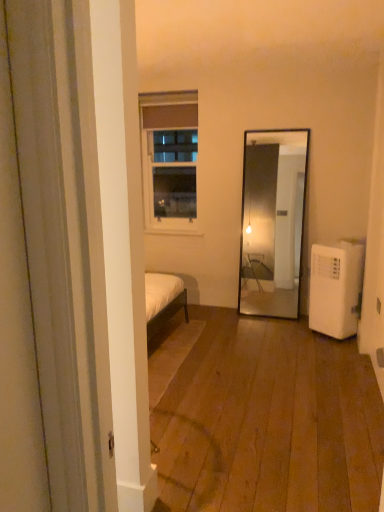
Locate an element on the screen. The height and width of the screenshot is (512, 384). white plastic air conditioner at lower right is located at coordinates (336, 288).

Measure the distance between point (318,273) and camera.

They are 3.74 meters apart.

The height and width of the screenshot is (512, 384). What do you see at coordinates (336, 288) in the screenshot?
I see `white plastic air conditioner at lower right` at bounding box center [336, 288].

What is the approximate height of white plastic air conditioner at lower right?

white plastic air conditioner at lower right is 32.95 inches tall.

This screenshot has width=384, height=512. Identify the location of white glass window at upper center. (169, 157).

The width and height of the screenshot is (384, 512). What do you see at coordinates (169, 157) in the screenshot?
I see `white glass window at upper center` at bounding box center [169, 157].

The image size is (384, 512). In order to click on white plastic air conditioner at lower right in this screenshot , I will do `click(336, 288)`.

Between white glass window at upper center and white plastic air conditioner at lower right, which one appears on the right side from the viewer's perspective?

white plastic air conditioner at lower right.

Which is in front, white glass window at upper center or white plastic air conditioner at lower right?

white plastic air conditioner at lower right.

Between point (145, 149) and point (354, 316), which one is positioned in front?

Point (354, 316)

From the image's perspective, which one is positioned higher, white glass window at upper center or white plastic air conditioner at lower right?

From the image's view, white glass window at upper center is above.

From a real-world perspective, between white glass window at upper center and white plastic air conditioner at lower right, who is vertically higher?

white glass window at upper center.

Considering the relative sizes of white glass window at upper center and white plastic air conditioner at lower right in the image provided, is white glass window at upper center thinner than white plastic air conditioner at lower right?

Yes.

Is white glass window at upper center taller or shorter than white plastic air conditioner at lower right?

Clearly, white glass window at upper center is taller compared to white plastic air conditioner at lower right.

Is white glass window at upper center smaller than white plastic air conditioner at lower right?

Indeed, white glass window at upper center has a smaller size compared to white plastic air conditioner at lower right.

Is white glass window at upper center inside the boundaries of white plastic air conditioner at lower right, or outside?

white glass window at upper center is not enclosed by white plastic air conditioner at lower right.

Consider the image. Are white glass window at upper center and white plastic air conditioner at lower right far apart?

Indeed, white glass window at upper center is not near white plastic air conditioner at lower right.

Does white glass window at upper center turn towards white plastic air conditioner at lower right?

No, white glass window at upper center is not turned towards white plastic air conditioner at lower right.

Measure the distance from white glass window at upper center to white plastic air conditioner at lower right.

The distance of white glass window at upper center from white plastic air conditioner at lower right is 6.15 feet.

Locate an element on the screen. This screenshot has height=512, width=384. air conditioner in front of the white glass window at upper center is located at coordinates (336, 288).

Does white plastic air conditioner at lower right appear on the right side of white glass window at upper center?

Yes, white plastic air conditioner at lower right is to the right of white glass window at upper center.

Between white plastic air conditioner at lower right and white glass window at upper center, which one is positioned in front?

white plastic air conditioner at lower right is in front.

Considering the points (353, 285) and (187, 206), which point is in front, point (353, 285) or point (187, 206)?

The point (353, 285) is more forward.

Consider the image. From the image's perspective, does white plastic air conditioner at lower right appear lower than white glass window at upper center?

Indeed, from the image's perspective, white plastic air conditioner at lower right is shown beneath white glass window at upper center.

From a real-world perspective, is white plastic air conditioner at lower right physically above white glass window at upper center?

Actually, white plastic air conditioner at lower right is physically below white glass window at upper center in the real world.

Considering the sizes of objects white plastic air conditioner at lower right and white glass window at upper center in the image provided, who is wider, white plastic air conditioner at lower right or white glass window at upper center?

With larger width is white plastic air conditioner at lower right.

Considering the sizes of objects white plastic air conditioner at lower right and white glass window at upper center in the image provided, who is taller, white plastic air conditioner at lower right or white glass window at upper center?

white glass window at upper center.

Looking at the image, does white plastic air conditioner at lower right seem bigger or smaller compared to white glass window at upper center?

Considering their sizes, white plastic air conditioner at lower right takes up more space than white glass window at upper center.

Do you think white plastic air conditioner at lower right is within white glass window at upper center, or outside of it?

white plastic air conditioner at lower right is not enclosed by white glass window at upper center.

Can you see white plastic air conditioner at lower right touching white glass window at upper center?

A: No, white plastic air conditioner at lower right is not in contact with white glass window at upper center.

In the scene shown: Is white plastic air conditioner at lower right facing towards white glass window at upper center?

Yes, white plastic air conditioner at lower right is oriented towards white glass window at upper center.

How many degrees apart are the facing directions of white plastic air conditioner at lower right and white glass window at upper center?

white plastic air conditioner at lower right and white glass window at upper center are facing 89.1 degrees away from each other.

The height and width of the screenshot is (512, 384). I want to click on window above the white plastic air conditioner at lower right (from the image's perspective), so click(169, 157).

Where is `window located on the left of white plastic air conditioner at lower right`? The image size is (384, 512). window located on the left of white plastic air conditioner at lower right is located at coordinates (169, 157).

Identify the location of window behind the white plastic air conditioner at lower right. (169, 157).